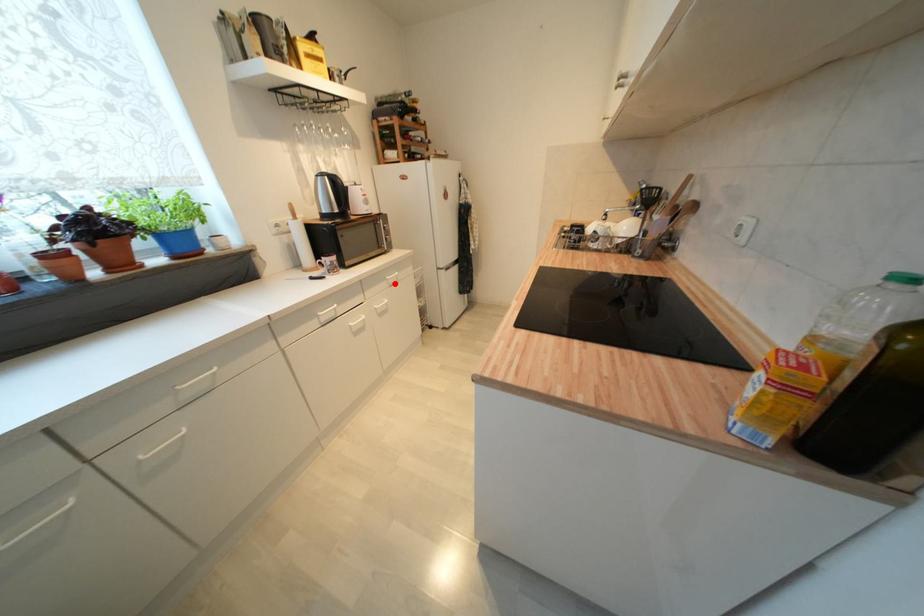
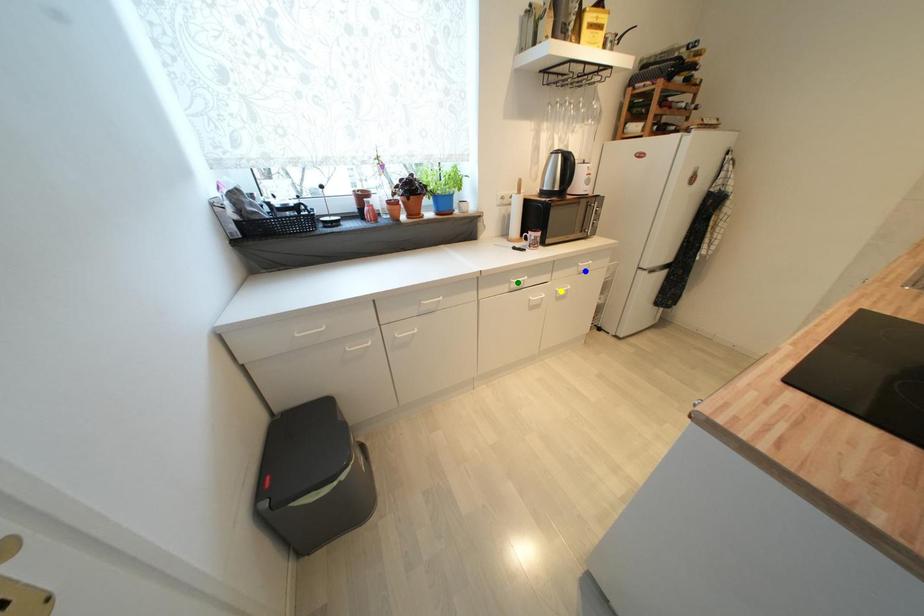
Question: I am providing you with two images of the same scene from different viewpoints. A red point is marked on the first image. You are given multiple points on the second image. Which mark in image 2 goes with the point in image 1?

Choices:
 (A) blue point
 (B) green point
 (C) yellow point

Answer: (A)